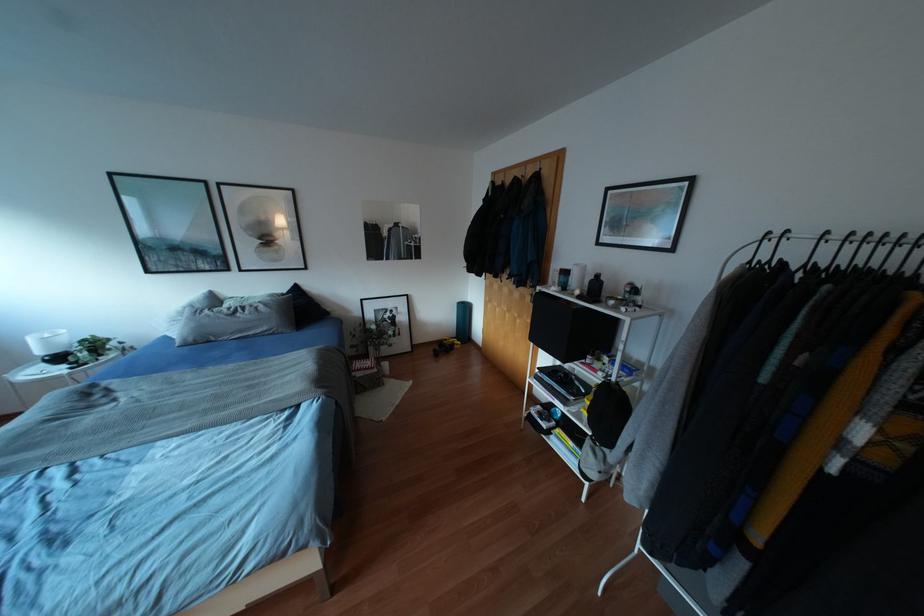
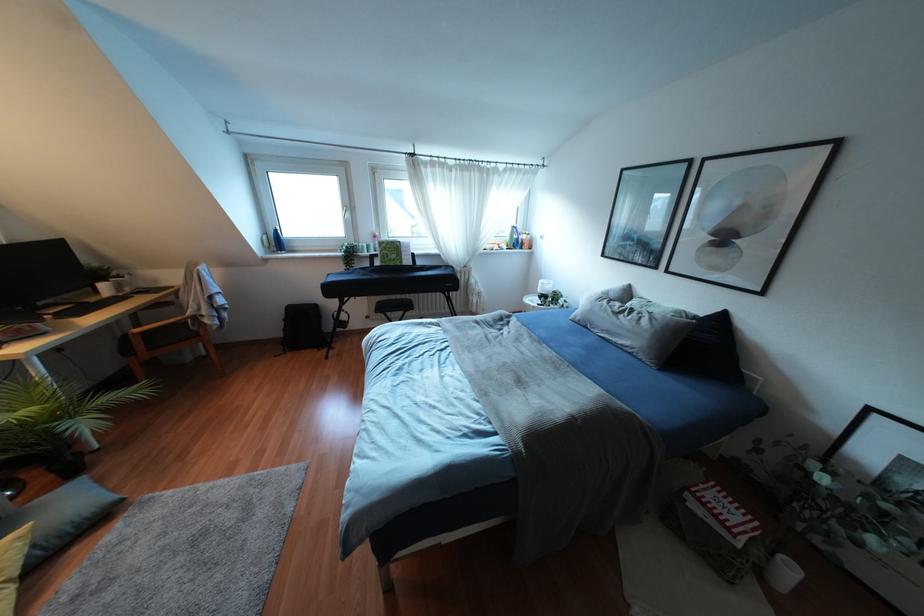
Find the pixel in the second image that matches (237,314) in the first image.

(619, 315)